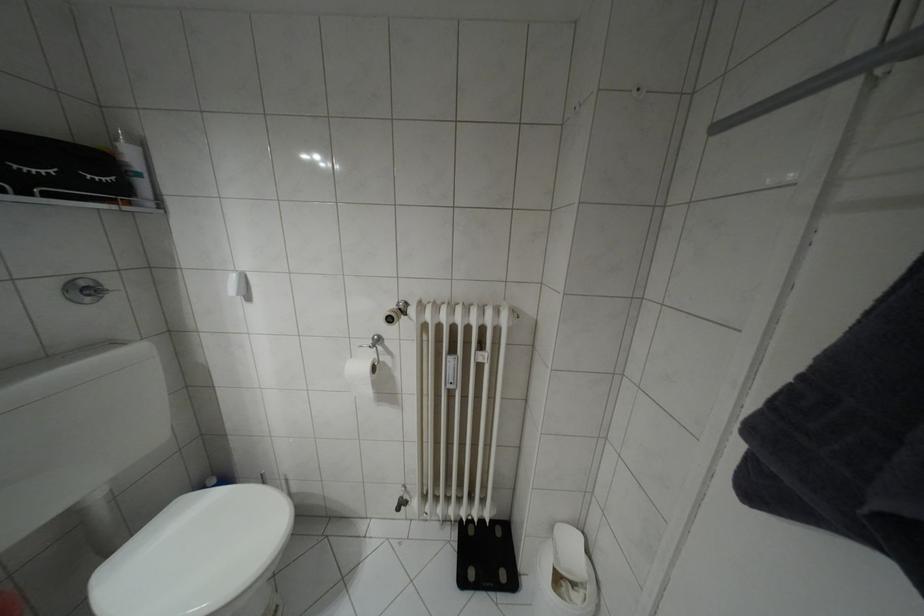
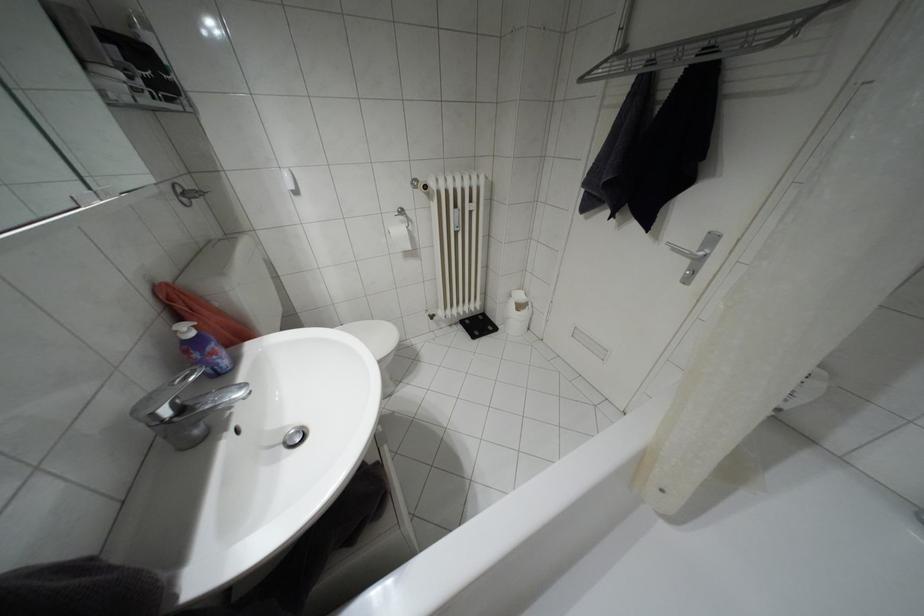
The point at (x=462, y=581) is marked in the first image. Where is the corresponding point in the second image?

(472, 336)